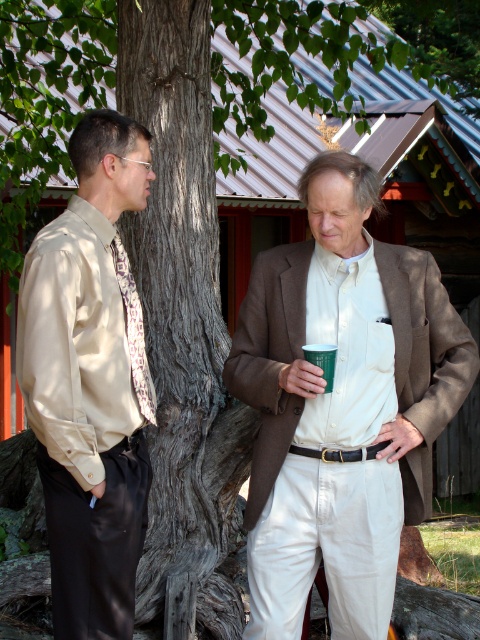
Question: Can you confirm if brown woolen blazer at center is positioned to the right of dark brown textured bark at center?

Choices:
 (A) no
 (B) yes

Answer: (B)

Question: Considering the relative positions of dark brown textured bark at center and matte beige shirt at left in the image provided, where is dark brown textured bark at center located with respect to matte beige shirt at left?

Choices:
 (A) right
 (B) left

Answer: (A)

Question: Estimate the real-world distances between objects in this image. Which object is farther from the green paper cup at center?

Choices:
 (A) matte beige shirt at left
 (B) dark brown textured bark at center
 (C) brown woolen blazer at center

Answer: (B)

Question: Can you confirm if dark brown textured bark at center is positioned above matte beige shirt at left?

Choices:
 (A) no
 (B) yes

Answer: (B)

Question: Which point appears closest to the camera in this image?

Choices:
 (A) (319, 356)
 (B) (420, 310)

Answer: (A)

Question: Estimate the real-world distances between objects in this image. Which object is closer to the dark brown textured bark at center?

Choices:
 (A) matte beige shirt at left
 (B) brown woolen blazer at center

Answer: (B)